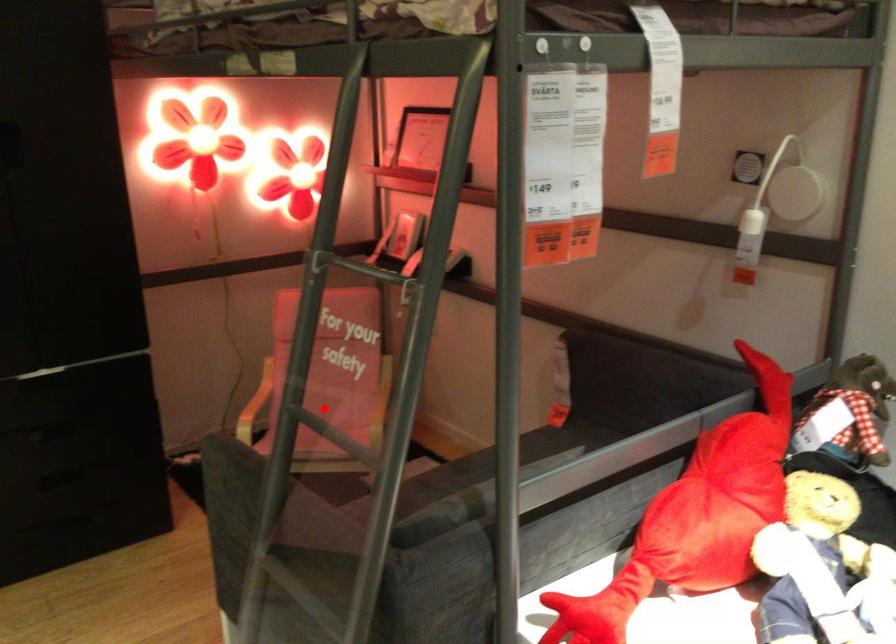
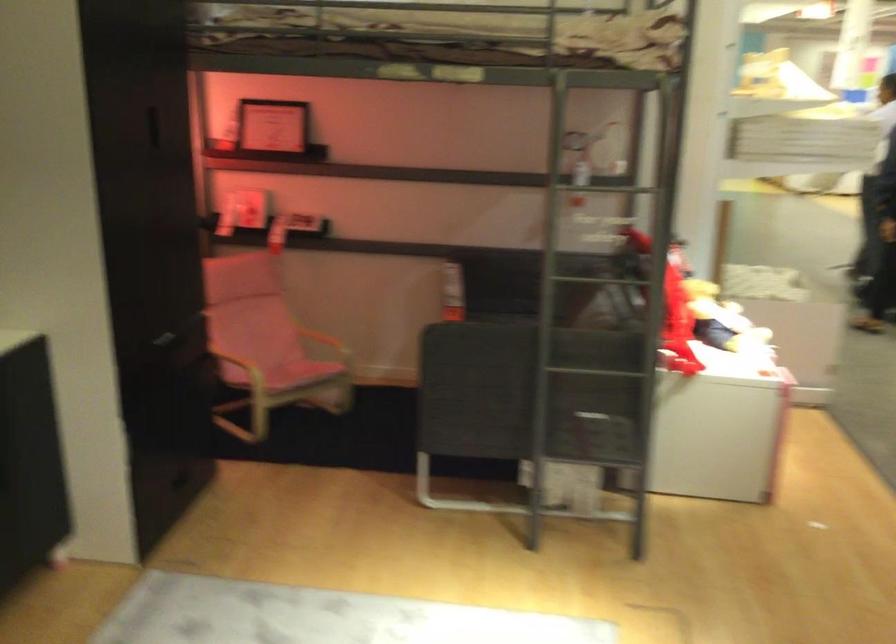
Where in the second image is the point corresponding to the highlighted location from the first image?

(268, 353)